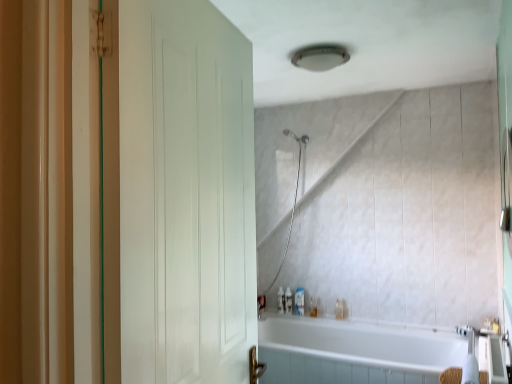
Question: Should I look upward or downward to see translucent plastic bottle at lower center, the 1th toiletry positioned from the right?

Choices:
 (A) up
 (B) down

Answer: (B)

Question: Is white glossy bathtub at lower center oriented towards translucent plastic bottle at lower center, placed as the 6th toiletry when sorted from right to left?

Choices:
 (A) no
 (B) yes

Answer: (A)

Question: Considering the relative sizes of white glossy bathtub at lower center and translucent plastic bottle at lower center, placed as the 6th toiletry when sorted from right to left, in the image provided, is white glossy bathtub at lower center taller than translucent plastic bottle at lower center, placed as the 6th toiletry when sorted from right to left,?

Choices:
 (A) no
 (B) yes

Answer: (B)

Question: Can you confirm if white glossy bathtub at lower center is smaller than translucent plastic bottle at lower center, placed as the first toiletry when sorted from left to right?

Choices:
 (A) yes
 (B) no

Answer: (B)

Question: Does white glossy bathtub at lower center have a larger size compared to translucent plastic bottle at lower center, placed as the first toiletry when sorted from left to right?

Choices:
 (A) yes
 (B) no

Answer: (A)

Question: Is there a large distance between white glossy bathtub at lower center and translucent plastic bottle at lower center, placed as the first toiletry when sorted from left to right?

Choices:
 (A) no
 (B) yes

Answer: (A)

Question: Is white glossy bathtub at lower center closer to the viewer compared to translucent plastic bottle at lower center, placed as the 6th toiletry when sorted from right to left?

Choices:
 (A) yes
 (B) no

Answer: (A)

Question: Can you confirm if translucent plastic bottle at lower center, positioned as the sixth toiletry in left-to-right order, is wider than translucent plastic soap dispenser at lower center, the fourth toiletry positioned from the right?

Choices:
 (A) yes
 (B) no

Answer: (B)

Question: Is translucent plastic bottle at lower center, positioned as the sixth toiletry in left-to-right order, positioned in front of translucent plastic soap dispenser at lower center, arranged as the 3th toiletry when viewed from the left?

Choices:
 (A) yes
 (B) no

Answer: (A)

Question: Is translucent plastic bottle at lower center, the 1th toiletry positioned from the right, not inside translucent plastic soap dispenser at lower center, the fourth toiletry positioned from the right?

Choices:
 (A) no
 (B) yes

Answer: (B)

Question: From the image's perspective, does translucent plastic bottle at lower center, positioned as the sixth toiletry in left-to-right order, appear lower than translucent plastic soap dispenser at lower center, arranged as the 3th toiletry when viewed from the left?

Choices:
 (A) no
 (B) yes

Answer: (B)

Question: Does translucent plastic bottle at lower center, the 1th toiletry positioned from the right, have a greater height compared to translucent plastic soap dispenser at lower center, arranged as the 3th toiletry when viewed from the left?

Choices:
 (A) no
 (B) yes

Answer: (A)

Question: Is there a large distance between translucent plastic bottle at lower center, the 1th toiletry positioned from the right, and translucent plastic soap dispenser at lower center, arranged as the 3th toiletry when viewed from the left?

Choices:
 (A) yes
 (B) no

Answer: (B)

Question: Is translucent plastic soap dispenser at lower center, placed as the fifth toiletry when sorted from right to left, wider than translucent plastic soap dispenser at lower center, arranged as the 3th toiletry when viewed from the left?

Choices:
 (A) yes
 (B) no

Answer: (A)